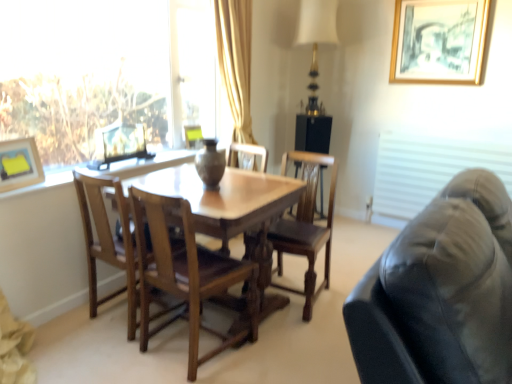
At what (x,y) coordinates should I click in order to perform the action: click on vacant space in front of light brown wood chair at center, which is the 3th chair in right-to-left order. Please return your answer as a coordinate pair (x, y). Looking at the image, I should click on (103, 355).